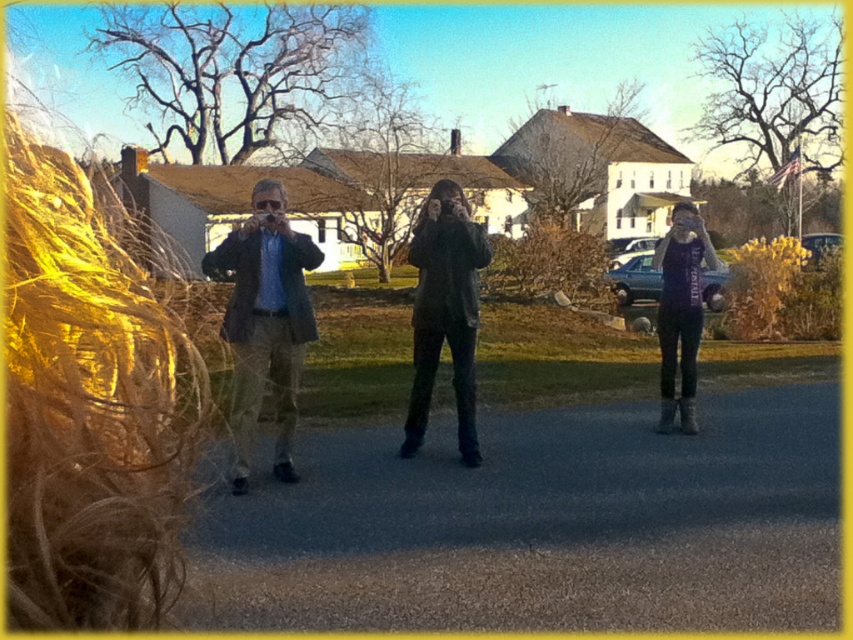
Question: Which point is closer to the camera taking this photo?

Choices:
 (A) (294, 326)
 (B) (466, 353)
 (C) (682, 230)

Answer: (A)

Question: Among these points, which one is nearest to the camera?

Choices:
 (A) (293, 292)
 (B) (677, 250)

Answer: (A)

Question: Which of the following is the closest to the observer?

Choices:
 (A) (257, 406)
 (B) (666, 328)
 (C) (466, 364)

Answer: (A)

Question: Can you confirm if matte brown jacket at center is wider than purple jersey at center?

Choices:
 (A) yes
 (B) no

Answer: (B)

Question: Is matte brown jacket at center thinner than purple jersey at center?

Choices:
 (A) no
 (B) yes

Answer: (B)

Question: Is matte brown jacket at center thinner than dark gray fabric jacket at center?

Choices:
 (A) no
 (B) yes

Answer: (B)